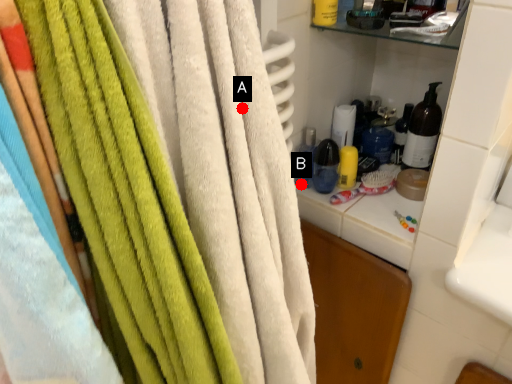
Question: Two points are circled on the image, labeled by A and B beside each circle. Which point is farther from the camera taking this photo?

Choices:
 (A) A is further
 (B) B is further

Answer: (B)